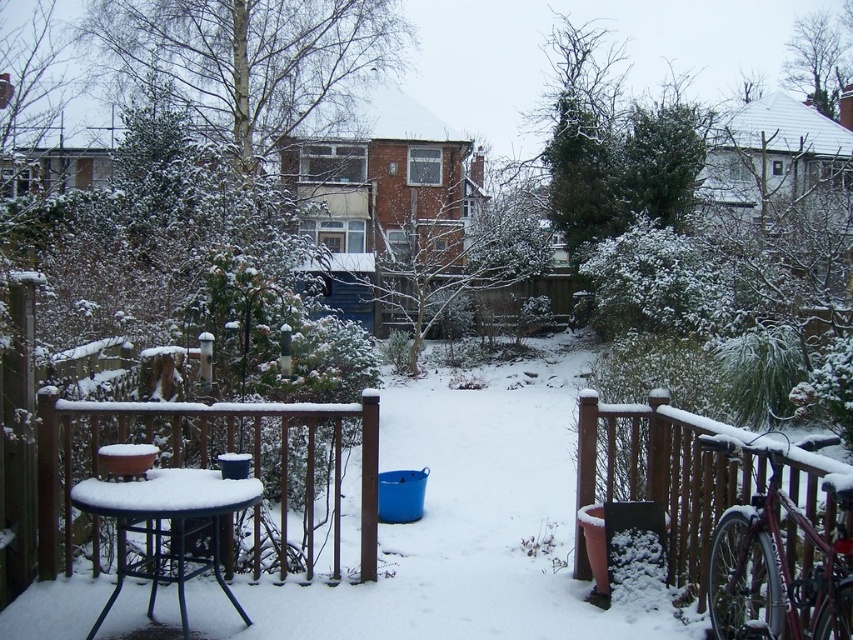
Question: Is brown wooden fence at center smaller than black metal table at lower left?

Choices:
 (A) yes
 (B) no

Answer: (B)

Question: Which object is farther from the camera taking this photo?

Choices:
 (A) brown wooden fence at lower right
 (B) black metal table at lower left

Answer: (B)

Question: Which point is closer to the camera taking this photo?

Choices:
 (A) (151, 525)
 (B) (44, 563)

Answer: (A)

Question: From the image, what is the correct spatial relationship of brown wooden fence at lower right in relation to black metal table at lower left?

Choices:
 (A) right
 (B) left

Answer: (A)

Question: Can you confirm if brown wooden fence at center is smaller than black metal table at lower left?

Choices:
 (A) yes
 (B) no

Answer: (B)

Question: Estimate the real-world distances between objects in this image. Which object is farther from the black metal table at lower left?

Choices:
 (A) brown wooden fence at lower right
 (B) brown wooden fence at center

Answer: (A)